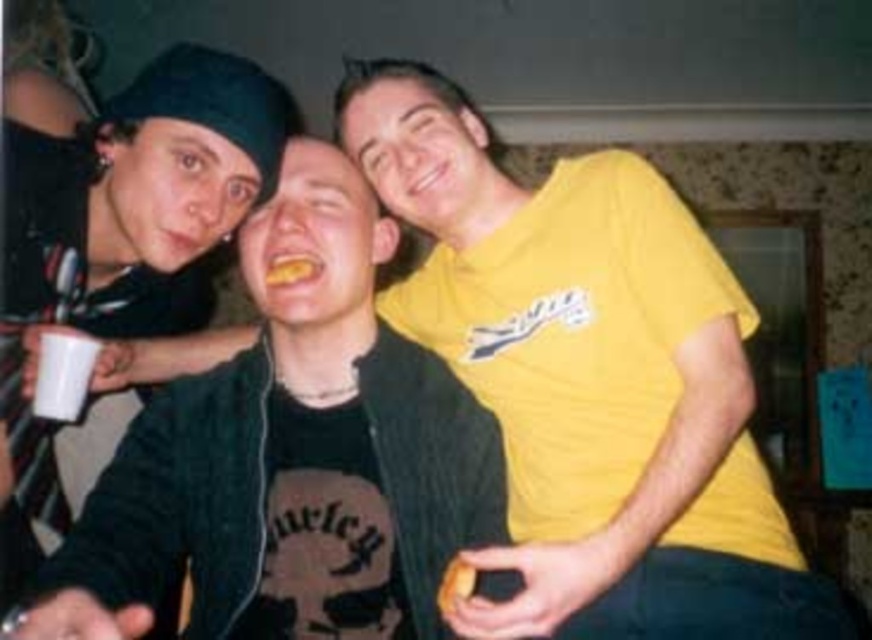
Between yellow cotton t-shirt at upper right and matte black jacket at center, which one appears on the right side from the viewer's perspective?

yellow cotton t-shirt at upper right

Which is in front, point (546, 272) or point (436, 458)?

Point (436, 458) is more forward.

The height and width of the screenshot is (640, 872). I want to click on yellow cotton t-shirt at upper right, so click(x=589, y=381).

Is yellow cotton t-shirt at upper right positioned at the back of white plastic cup at lower left?

No, yellow cotton t-shirt at upper right is closer to the viewer.

Does yellow cotton t-shirt at upper right appear on the right side of white plastic cup at lower left?

Yes, yellow cotton t-shirt at upper right is to the right of white plastic cup at lower left.

Who is more distant from viewer, (x=610, y=365) or (x=85, y=355)?

Positioned behind is point (x=85, y=355).

At what (x,y) coordinates should I click in order to perform the action: click on yellow cotton t-shirt at upper right. Please return your answer as a coordinate pair (x, y). The image size is (872, 640). Looking at the image, I should click on (589, 381).

Is matte black jacket at center shorter than white plastic cup at lower left?

Incorrect, matte black jacket at center's height does not fall short of white plastic cup at lower left's.

Can you confirm if matte black jacket at center is positioned to the left of white plastic cup at lower left?

Incorrect, matte black jacket at center is not on the left side of white plastic cup at lower left.

Is point (125, 515) more distant than point (48, 346)?

No, (125, 515) is in front of (48, 346).

Where is `matte black jacket at center`? matte black jacket at center is located at coordinates (266, 426).